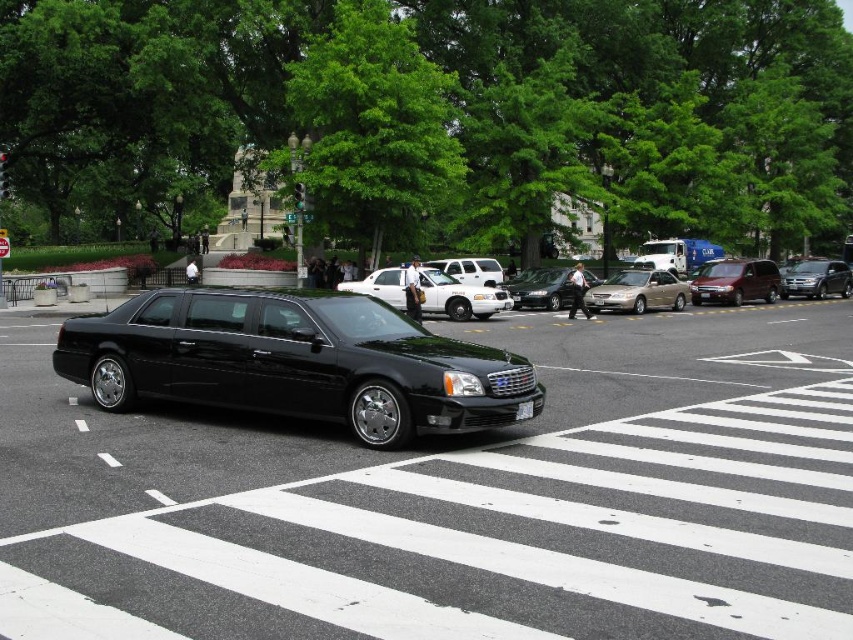
You are a traffic controller observing the street scene. The black glossy car at center is currently moving towards the crosswalk. Based on its current position at point 0.780, 0.533, will it pass through the crosswalk?

The black glossy car at center is positioned at point (454, 499), so it will pass through the crosswalk as it is moving towards it.

You are a pedestrian standing on the sidewalk. You see a black glossy car at center and a metallic gold sedan at center. Which car is nearer to you?

The black glossy car at center is closer to the viewer than the metallic gold sedan at center.

You are a pedestrian standing on the sidewalk watching the vehicles. Which vehicle, the shiny black limousine at center or the shiny silver sedan at center, is closer to you?

The shiny black limousine at center is closer to you because it is in front of the shiny silver sedan at center.